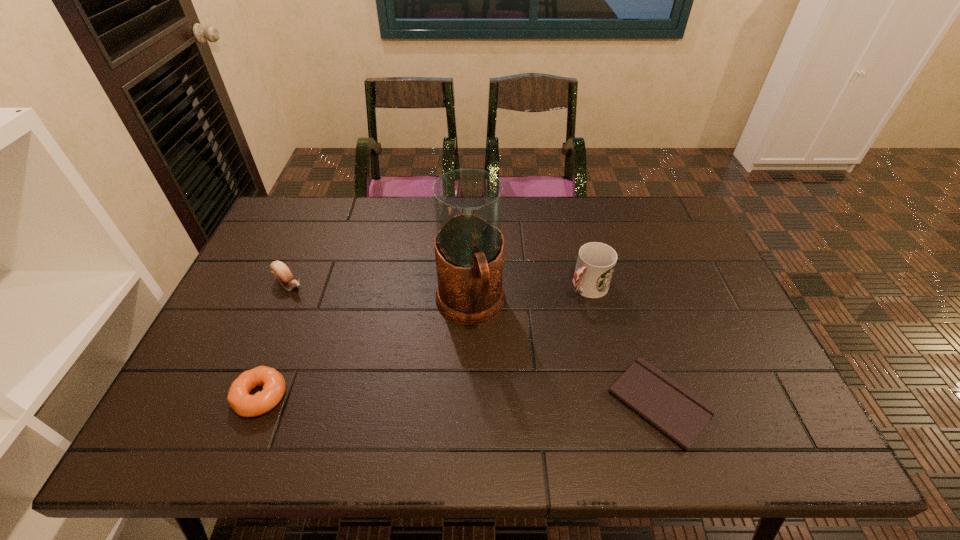
The image size is (960, 540). I want to click on vacant spot on the desktop that is between the second shortest object and the checkbook and is positioned on the side of the cup where the handle is located, so click(450, 400).

Find the location of `vacant space on the desktop that is between the second shortest object and the checkbook and is positioned on the front-facing side of the third shortest object`. vacant space on the desktop that is between the second shortest object and the checkbook and is positioned on the front-facing side of the third shortest object is located at coordinates (446, 400).

The width and height of the screenshot is (960, 540). In order to click on vacant space on the desktop that is between the doughnut and the shortest object and is positioned with the handle on the side of the third object from left to right in this screenshot , I will do `click(499, 401)`.